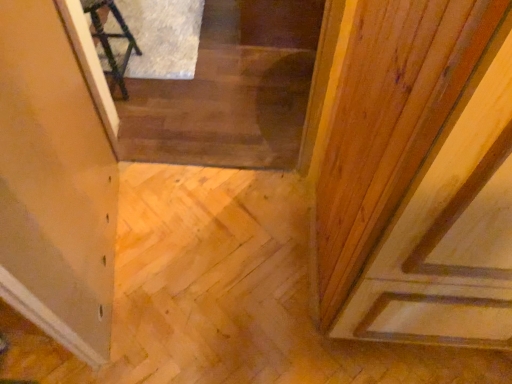
Where is `free spot above wooden stairs at center (from a real-world perspective)`? This screenshot has width=512, height=384. free spot above wooden stairs at center (from a real-world perspective) is located at coordinates (208, 74).